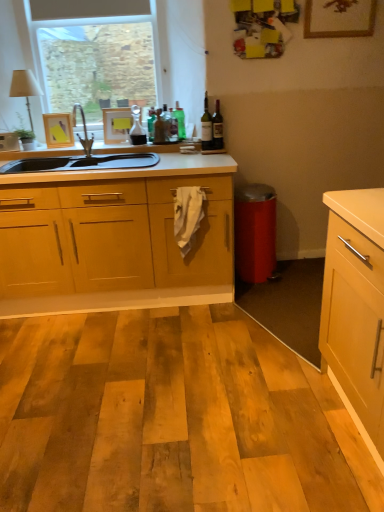
The image size is (384, 512). Find the location of `free space to the right of metallic faucet at upper left`. free space to the right of metallic faucet at upper left is located at coordinates (123, 152).